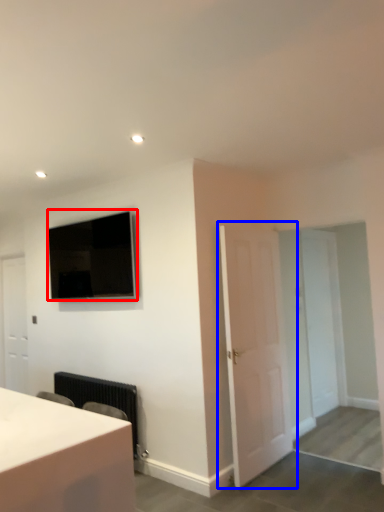
Question: Which of the following is the farthest to the observer, television (highlighted by a red box) or door (highlighted by a blue box)?

Choices:
 (A) television
 (B) door

Answer: (A)